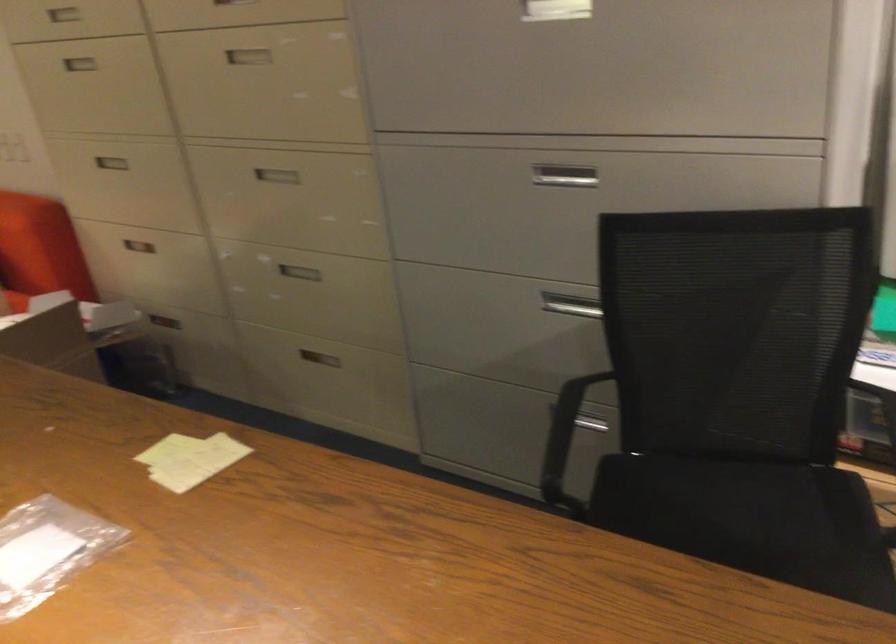
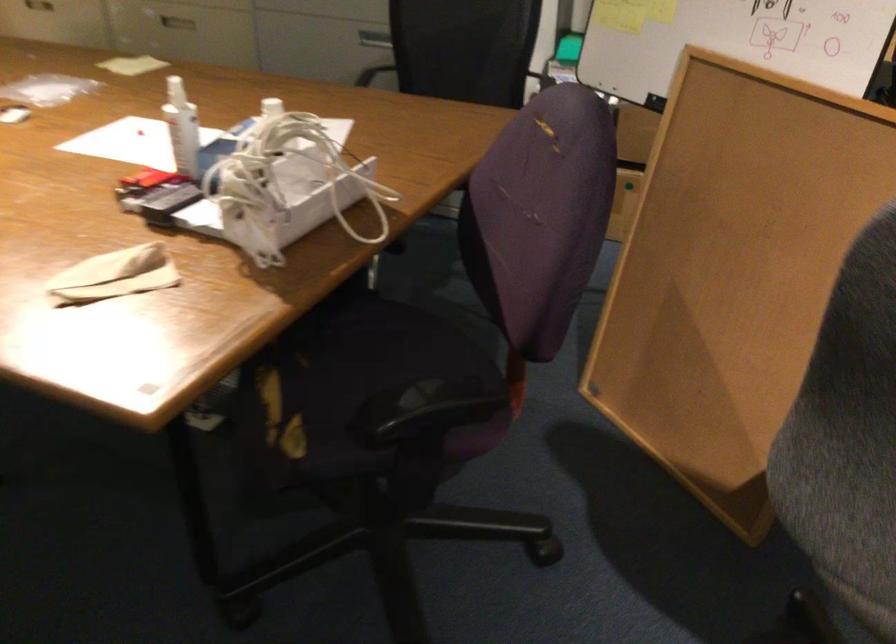
Question: I am providing you with two images of the same scene from different viewpoints. After the viewpoint changes to image2, which objects are now occluded?

Choices:
 (A) white water pitcher
 (B) chair sitting surface
 (C) red office tool
 (D) black chair armrest

Answer: (B)